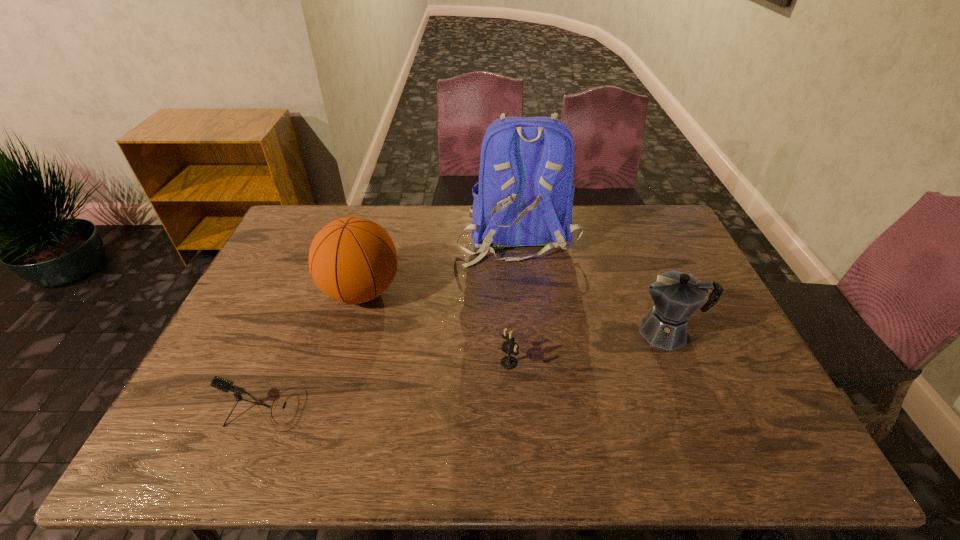
Find the location of a particular element. The width and height of the screenshot is (960, 540). vacant space at the left edge of the desktop is located at coordinates (269, 267).

Find the location of `free space at the right edge of the desktop`. free space at the right edge of the desktop is located at coordinates (733, 390).

In the image, there is a desktop. In order to click on vacant area at the far left corner in this screenshot , I will do `click(300, 219)`.

In the image, there is a desktop. Where is `free space at the far right corner`? This screenshot has height=540, width=960. free space at the far right corner is located at coordinates (653, 228).

This screenshot has height=540, width=960. I want to click on free spot at the near right corner of the desktop, so click(x=743, y=431).

Locate an element on the screen. The height and width of the screenshot is (540, 960). vacant region between the tallest object and the basketball is located at coordinates (439, 263).

The height and width of the screenshot is (540, 960). Find the location of `vacant region between the backpack and the basketball`. vacant region between the backpack and the basketball is located at coordinates (439, 263).

Locate an element on the screen. free point between the nearest object and the tallest object is located at coordinates (391, 322).

Find the location of a particular element. This screenshot has width=960, height=540. free space between the fourth farthest object and the nearest object is located at coordinates (387, 386).

At what (x,y) coordinates should I click in order to perform the action: click on vacant area that lies between the coffeepot and the tallest object. Please return your answer as a coordinate pair (x, y). Looking at the image, I should click on (591, 283).